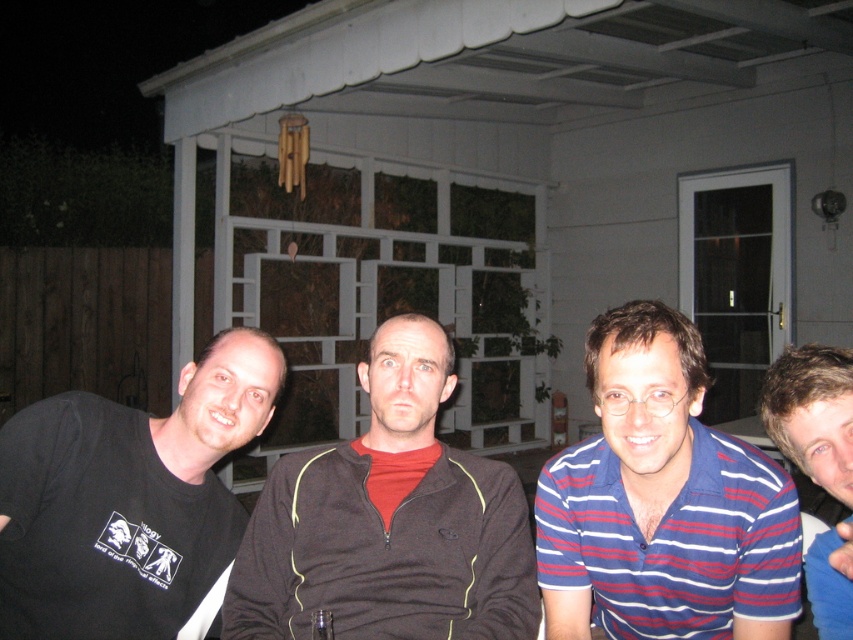
Is blue striped shirt at center to the left of blue striped shirt at right from the viewer's perspective?

Correct, you'll find blue striped shirt at center to the left of blue striped shirt at right.

In the scene shown: Does blue striped shirt at center have a smaller size compared to blue striped shirt at right?

Incorrect, blue striped shirt at center is not smaller in size than blue striped shirt at right.

Locate an element on the screen. blue striped shirt at center is located at coordinates (662, 500).

Is black matte shirt at left bigger than blue striped shirt at right?

Yes.

Does point (207, 438) come farther from viewer compared to point (784, 454)?

Yes, point (207, 438) is behind point (784, 454).

Locate an element on the screen. This screenshot has height=640, width=853. black matte shirt at left is located at coordinates (181, 484).

Can you confirm if blue striped shirt at center is positioned above black matte shirt at left?

No, blue striped shirt at center is not above black matte shirt at left.

Looking at this image, who is lower down, blue striped shirt at center or black matte shirt at left?

blue striped shirt at center is below.

Locate an element on the screen. The image size is (853, 640). blue striped shirt at center is located at coordinates (662, 500).